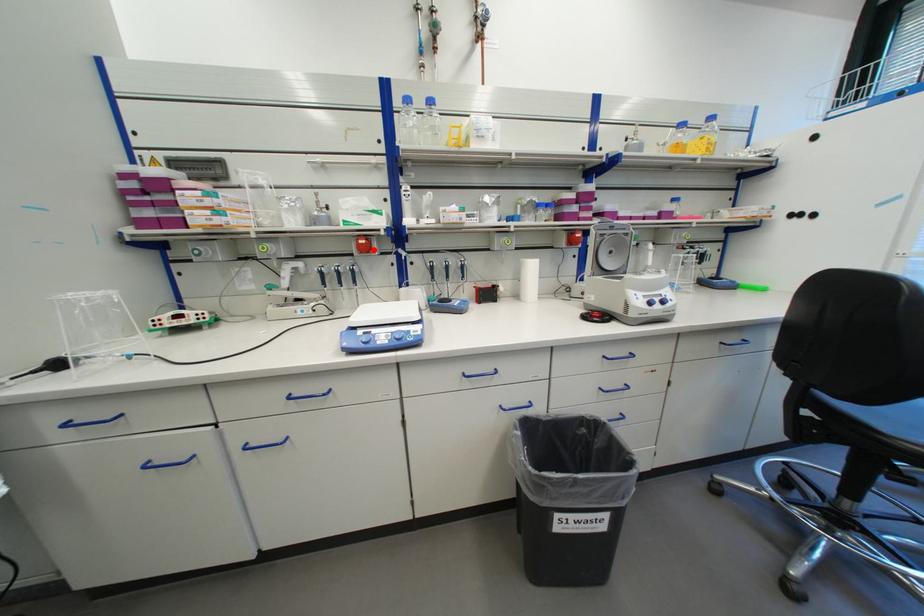
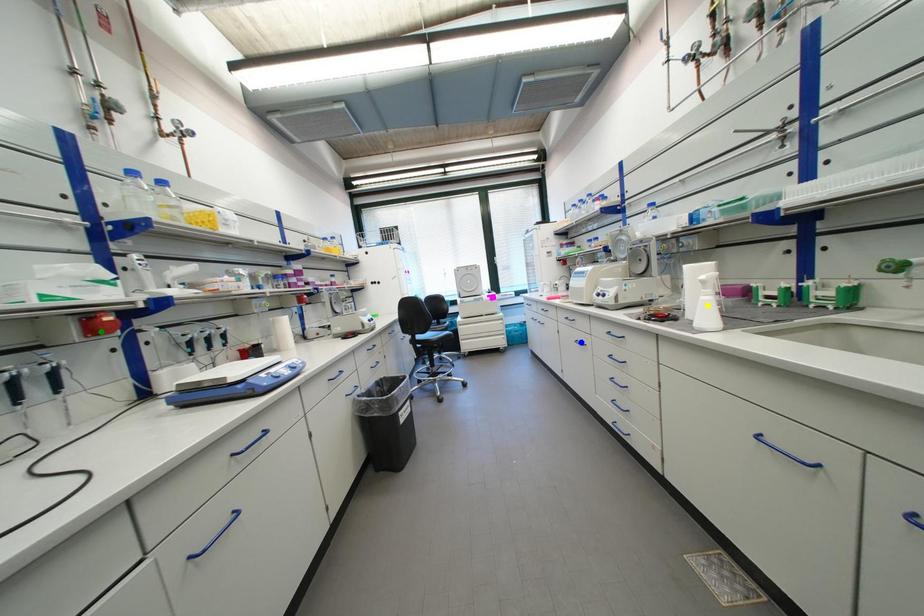
Question: I am providing you with two images of the same scene from different viewpoints. A red point is marked on the first image. You are given multiple points on the second image. Can you choose the point in image 2 that corresponds to the point in image 1?

Choices:
 (A) green point
 (B) yellow point
 (C) blue point

Answer: (A)